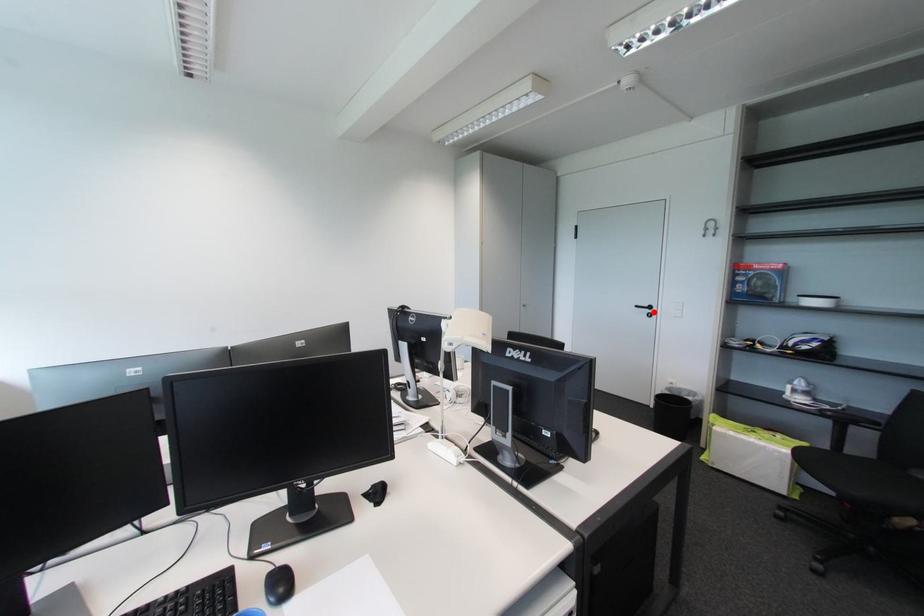
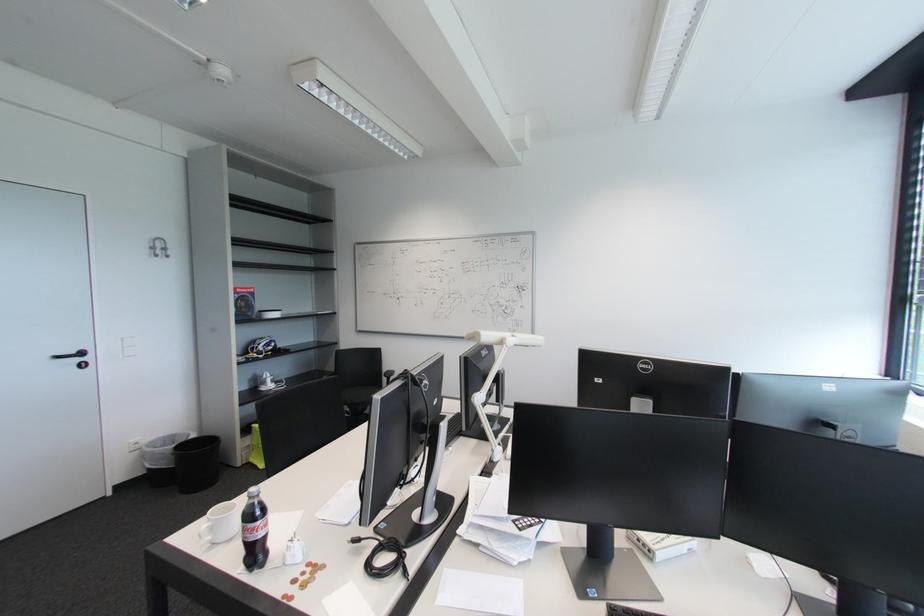
The point at the highlighted location is marked in the first image. Where is the corresponding point in the second image?

(83, 361)